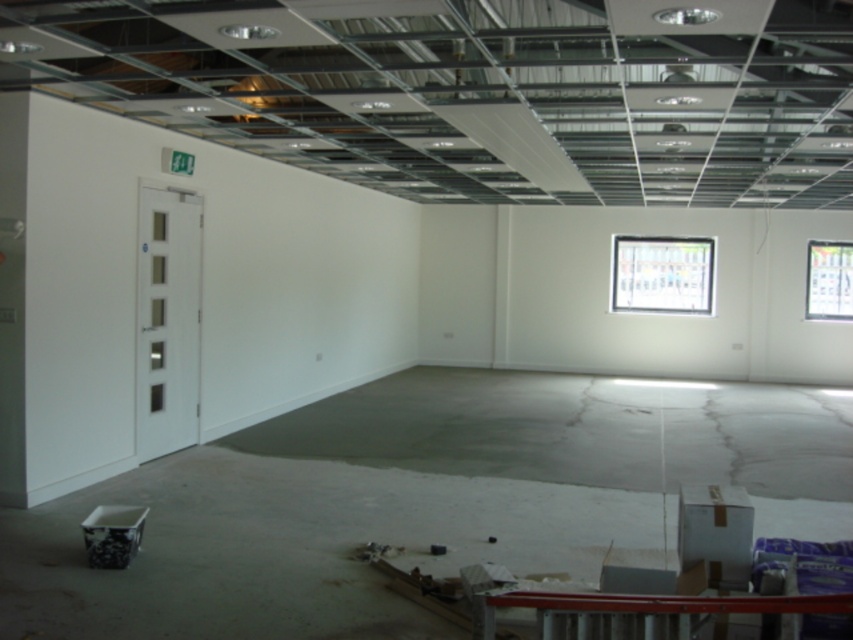
Does transparent glass window at upper center have a larger size compared to transparent glass window at upper right?

Indeed, transparent glass window at upper center has a larger size compared to transparent glass window at upper right.

Which is more to the left, transparent glass window at upper center or transparent glass window at upper right?

Positioned to the left is transparent glass window at upper center.

Does point (627, 248) come behind point (834, 308)?

Yes.

I want to click on transparent glass window at upper center, so click(662, 275).